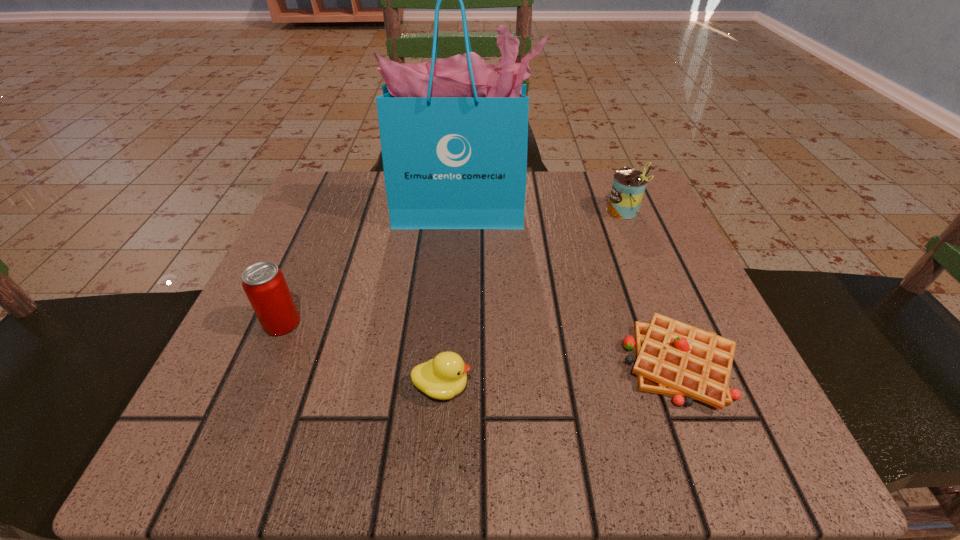
Find the location of a particular element. Image resolution: width=960 pixels, height=540 pixels. the tallest object is located at coordinates (454, 132).

Find the location of a particular element. The width and height of the screenshot is (960, 540). the farther can is located at coordinates tap(628, 187).

You are a GUI agent. You are given a task and a screenshot of the screen. Output one action in this format:
    pyautogui.click(x=<x>, y=<y>)
    Task: Click on the left can
    Image resolution: width=960 pixels, height=540 pixels.
    Given the screenshot: What is the action you would take?
    pyautogui.click(x=264, y=284)

Locate an element on the screen. the leftmost object is located at coordinates (264, 284).

Identify the location of the fourth tallest object. (443, 377).

Where is `waffle`? waffle is located at coordinates (673, 358).

Locate an element on the screen. vacant space located on the back of the tallest object is located at coordinates (464, 179).

This screenshot has height=540, width=960. I want to click on vacant point located 0.120m on the left of the farther can, so click(x=549, y=211).

I want to click on free spot located on the back of the nearer can, so click(x=303, y=273).

Locate an element on the screen. This screenshot has height=540, width=960. vacant space located on the beak of the duckling is located at coordinates (551, 387).